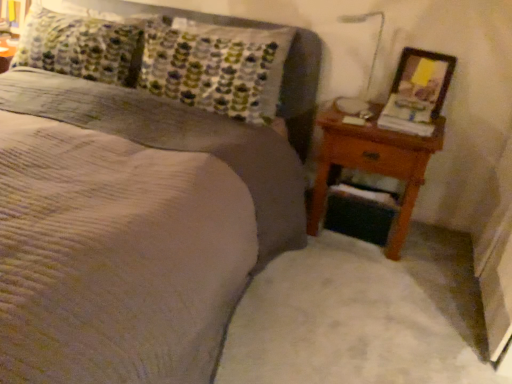
Question: From a real-world perspective, is brown wooden nightstand at right over textured gray bed at center?

Choices:
 (A) yes
 (B) no

Answer: (B)

Question: Does brown wooden nightstand at right touch textured gray bed at center?

Choices:
 (A) yes
 (B) no

Answer: (B)

Question: From the image's perspective, does brown wooden nightstand at right appear higher than textured gray bed at center?

Choices:
 (A) yes
 (B) no

Answer: (B)

Question: Is brown wooden nightstand at right at the right side of textured gray bed at center?

Choices:
 (A) yes
 (B) no

Answer: (A)

Question: Does brown wooden nightstand at right have a smaller size compared to textured gray bed at center?

Choices:
 (A) no
 (B) yes

Answer: (B)

Question: From the image's perspective, relative to brown wooden nightstand at right, is textured gray bed at center above or below?

Choices:
 (A) above
 (B) below

Answer: (A)

Question: Would you say textured gray bed at center is inside or outside brown wooden nightstand at right?

Choices:
 (A) inside
 (B) outside

Answer: (B)

Question: Visually, is textured gray bed at center positioned to the left or to the right of brown wooden nightstand at right?

Choices:
 (A) left
 (B) right

Answer: (A)

Question: Is textured gray bed at center in front of or behind brown wooden nightstand at right in the image?

Choices:
 (A) behind
 (B) front

Answer: (B)

Question: From a real-world perspective, is textured gray bed at center above or below wooden picture frame at right?

Choices:
 (A) above
 (B) below

Answer: (B)

Question: Is textured gray bed at center wider or thinner than wooden picture frame at right?

Choices:
 (A) wide
 (B) thin

Answer: (A)

Question: From the image's perspective, is textured gray bed at center located above or below wooden picture frame at right?

Choices:
 (A) above
 (B) below

Answer: (B)

Question: Looking at the image, does textured gray bed at center seem bigger or smaller compared to wooden picture frame at right?

Choices:
 (A) small
 (B) big

Answer: (B)

Question: Considering the positions of brown wooden nightstand at right and textured gray bed at center in the image, is brown wooden nightstand at right taller or shorter than textured gray bed at center?

Choices:
 (A) short
 (B) tall

Answer: (A)

Question: From a real-world perspective, is brown wooden nightstand at right physically located above or below textured gray bed at center?

Choices:
 (A) below
 (B) above

Answer: (A)